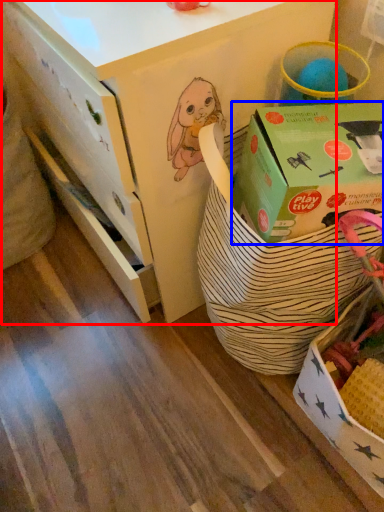
Question: Which point is closer to the camera, desk (highlighted by a red box) or box (highlighted by a blue box)?

Choices:
 (A) desk
 (B) box

Answer: (B)